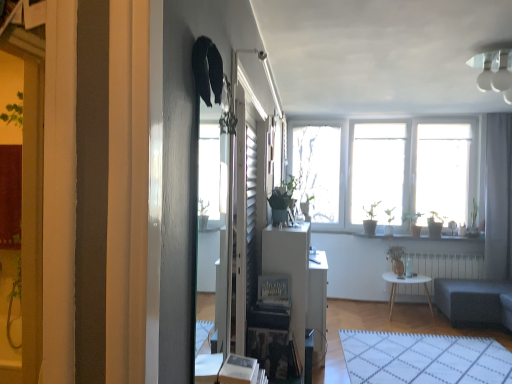
Locate an element on the screen. free region under white grid rug at lower center (from a real-world perspective) is located at coordinates coord(439,355).